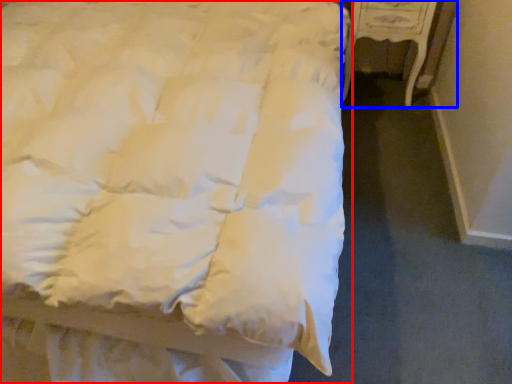
Question: Which of the following is the farthest to the observer, bed (highlighted by a red box) or furniture (highlighted by a blue box)?

Choices:
 (A) bed
 (B) furniture

Answer: (B)